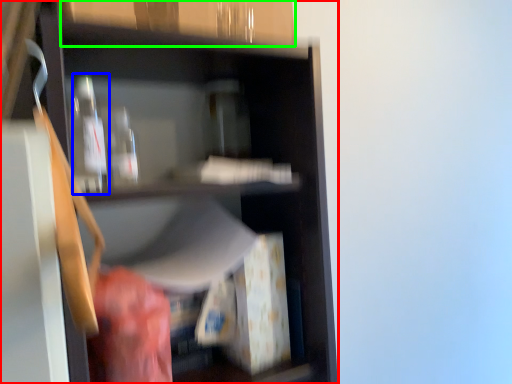
Question: Which is farther away from shelf (highlighted by a red box)? bottle (highlighted by a blue box) or cabinetry (highlighted by a green box)?

Choices:
 (A) bottle
 (B) cabinetry

Answer: (B)